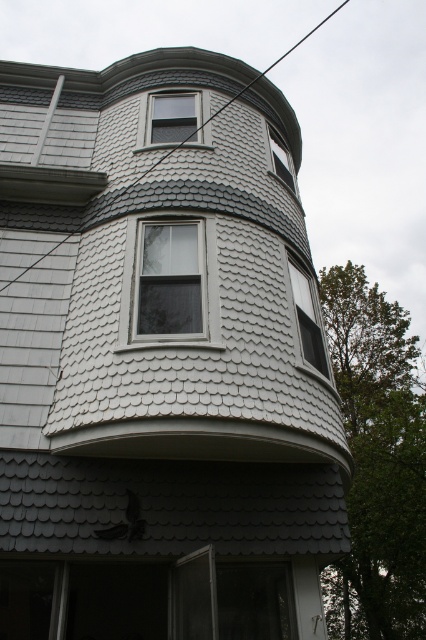
From the picture: You are a window installer assessing the bay window structure. You need to determine if the clear glass window at center can be replaced with a wider window without affecting the structural integrity of the black wire at upper center. Based on the current dimensions, is this possible?

The clear glass window at center has a lesser width compared to black wire at upper center. Therefore, replacing it with a wider window might interfere with the black wire at upper center, potentially compromising structural integrity. It is advisable to consult architectural plans before proceeding.

You are a window installer assessing the bay window structure. You need to replace the clear glass window at center. Will the black wire at upper center interfere with your installation process?

The clear glass window at center is in front of the black wire at upper center, so the wire will not interfere with the installation process as it is positioned behind the window.

You are standing 10 meters away from the building and want to see if you can reach the clear glass window at upper center with a 1.5 meter long pole. Can you reach it?

The clear glass window at upper center is 8.60 meters away from the camera. Since you are standing 10 meters away, the total distance would be 18.60 meters. The pole is only 1.5 meters long, so you cannot reach the clear glass window at upper center.